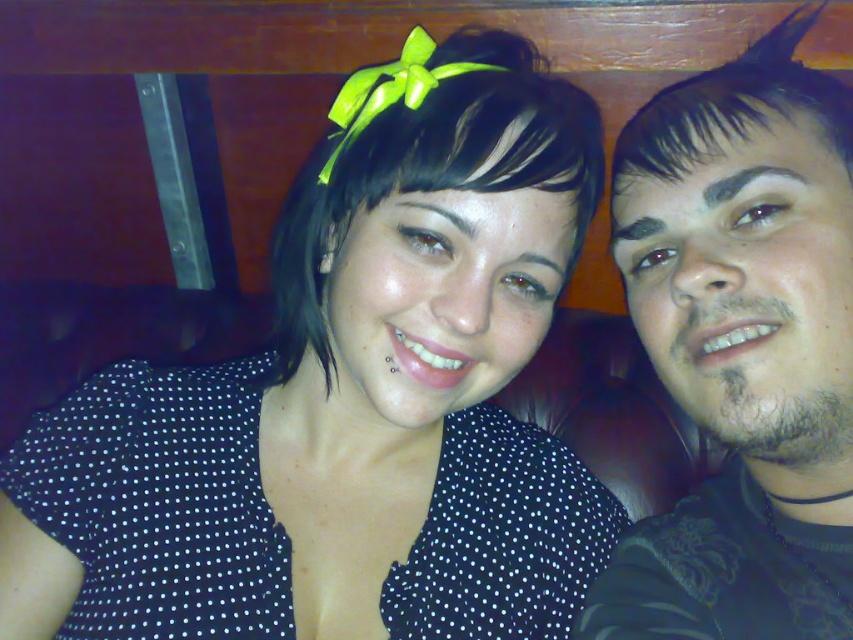
You are taking a photo of two people standing side by side. You notice the black shiny hair at center and the dark brown shiny hair at upper right. Which hair is closer to the camera?

The black shiny hair at center is closer to the viewer than the dark brown shiny hair at upper right.

You are a photographer trying to capture a closeup shot of both the black shiny hair at center and the dark brown shiny hair at upper right. Since you want to ensure both are in focus, which hair should you adjust the camera focus on first considering their sizes?

The black shiny hair at center is bigger than dark brown shiny hair at upper right, so you should focus on the black shiny hair at center first as it is larger and might require more precise focusing to ensure clarity.

You are using a smartphone camera to take a photo of the scene. The camera has a grid overlay with coordinates from 0 to 1 on both axes. Where would you position the center of the black dotted shirt at center to ensure it aligns with the grid point at 0.625 on the x and 0.408 on the y? Please provide the coordinates in the format of x,y.

The black dotted shirt at center is located at the 2D coordinates of 0.625 on the x and 0.408 on the y, so positioning it there would align it perfectly with the grid point.